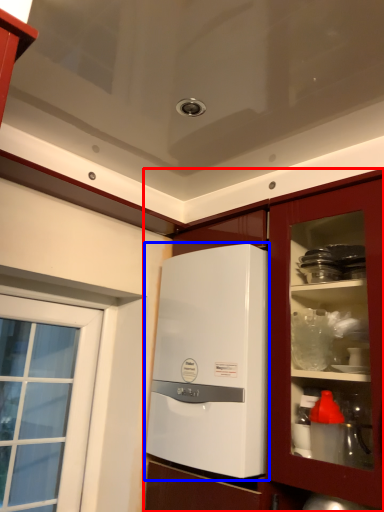
Question: Among these objects, which one is farthest to the camera, cabinetry (highlighted by a red box) or home appliance (highlighted by a blue box)?

Choices:
 (A) cabinetry
 (B) home appliance

Answer: (B)